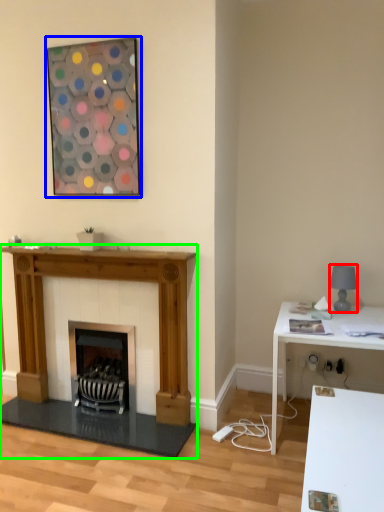
Question: Estimate the real-world distances between objects in this image. Which object is closer to lamp (highlighted by a red box), picture frame (highlighted by a blue box) or fireplace (highlighted by a green box)?

Choices:
 (A) picture frame
 (B) fireplace

Answer: (B)